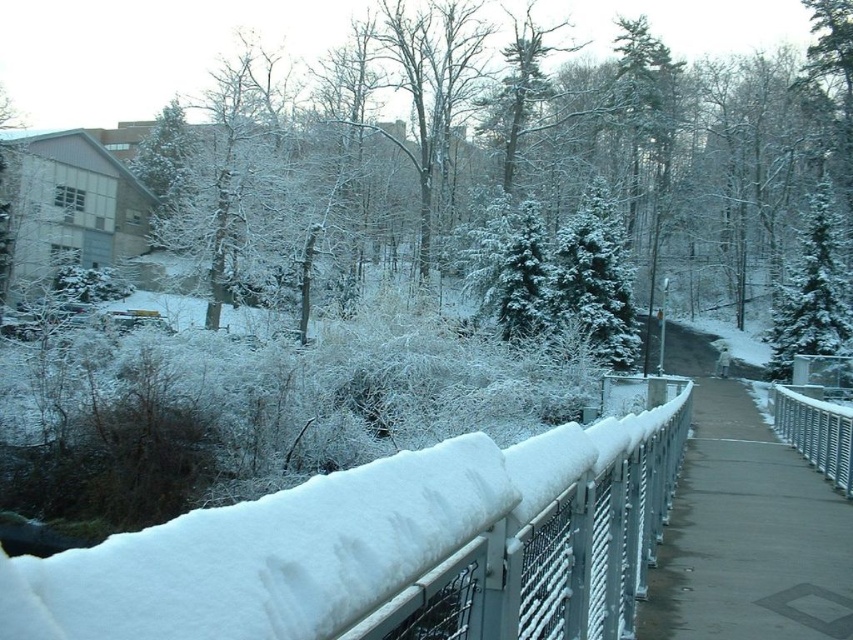
You are a delivery robot that needs to navigate through the gray concrete pavement at center and the silver metallic fence at right. Which path has a narrower width for your route?

The gray concrete pavement at center has a lesser width compared to the silver metallic fence at right, so the gray concrete pavement at center is narrower and would be the narrower path for your route.